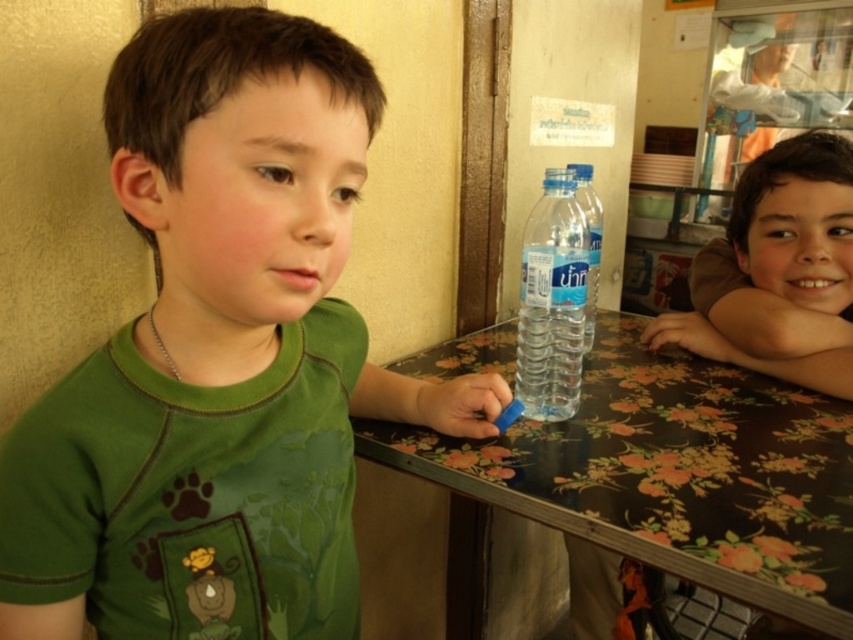
Question: Which is farther from the brown matte face at upper right?

Choices:
 (A) floral-patterned wood at center
 (B) clear plastic bottle at center

Answer: (B)

Question: Does clear plastic bottle at center have a larger size compared to translucent plastic bottle at center?

Choices:
 (A) yes
 (B) no

Answer: (A)

Question: Which of the following is the closest to the observer?

Choices:
 (A) clear plastic bottle at center
 (B) green matte shirt at left
 (C) brown matte face at upper right

Answer: (B)

Question: Can you confirm if brown matte face at upper right is thinner than clear plastic bottle at center?

Choices:
 (A) no
 (B) yes

Answer: (A)

Question: Observing the image, what is the correct spatial positioning of floral-patterned wood at center in reference to clear plastic bottle at center?

Choices:
 (A) left
 (B) right

Answer: (B)

Question: Which point appears farthest from the camera in this image?

Choices:
 (A) (547, 262)
 (B) (831, 204)
 (C) (15, 570)

Answer: (B)